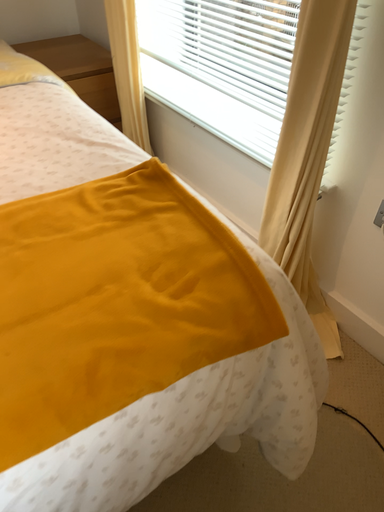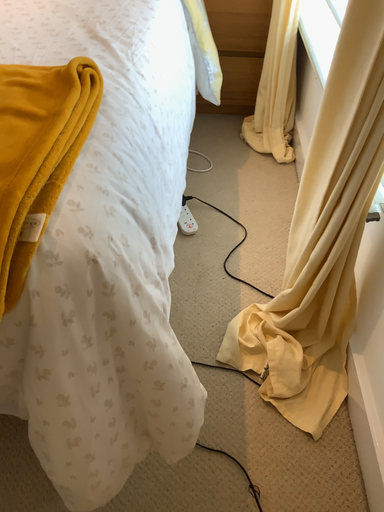
Question: How did the camera likely rotate when shooting the video?

Choices:
 (A) rotated left
 (B) rotated right

Answer: (A)